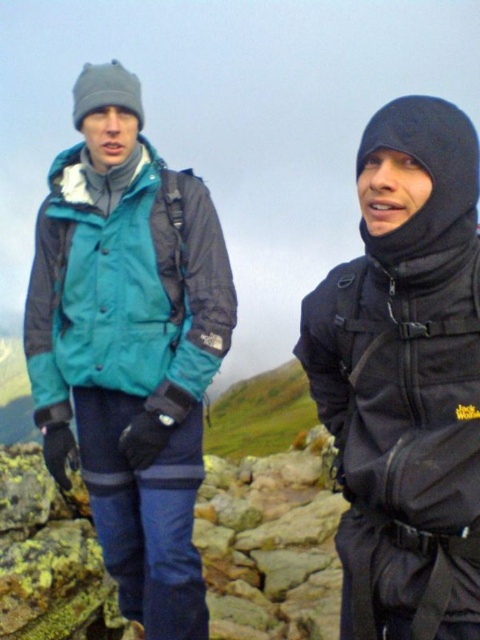
Question: Does black softshell jacket at right have a smaller size compared to teal fabric jacket at left?

Choices:
 (A) no
 (B) yes

Answer: (A)

Question: Does black softshell jacket at right have a lesser width compared to teal fabric jacket at left?

Choices:
 (A) no
 (B) yes

Answer: (A)

Question: Which of the following is the closest to the observer?

Choices:
 (A) teal fabric jacket at left
 (B) black softshell jacket at right

Answer: (B)

Question: Is black softshell jacket at right bigger than teal fabric jacket at left?

Choices:
 (A) no
 (B) yes

Answer: (B)

Question: Which point is closer to the camera?

Choices:
 (A) (192, 257)
 (B) (391, 342)

Answer: (B)

Question: Which object is closer to the camera taking this photo?

Choices:
 (A) black softshell jacket at right
 (B) teal fabric jacket at left

Answer: (A)